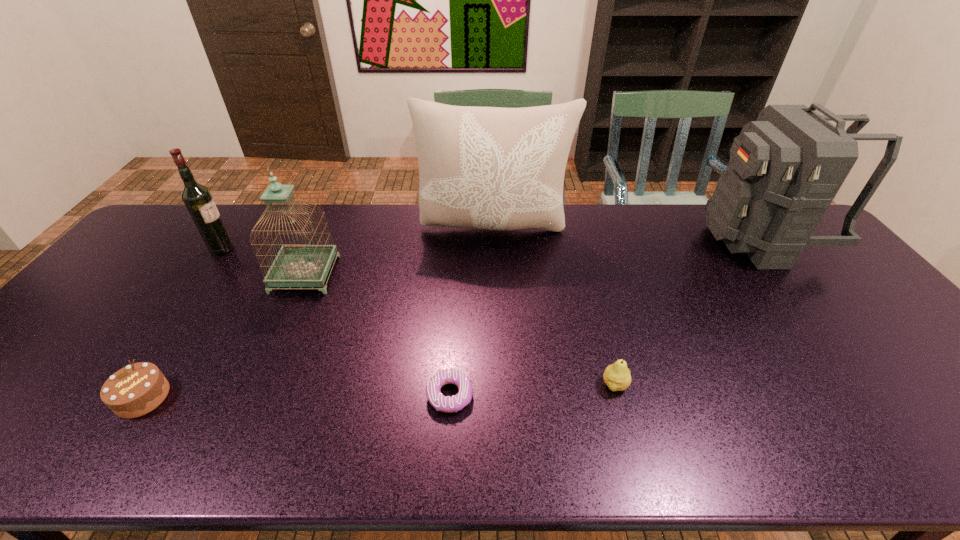
This screenshot has width=960, height=540. I want to click on free space that satisfies the following two spatial constraints: 1. on the front and back of the pear; 2. on the left side of the wine bottle, so click(128, 384).

Find the location of a particular element. The image size is (960, 540). blank area in the image that satisfies the following two spatial constraints: 1. on the front compartment of the rightmost object; 2. on the front side of the pear is located at coordinates (874, 384).

Identify the location of free space that satisfies the following two spatial constraints: 1. at the door of the pear; 2. on the right side of the third object from left to right. The width and height of the screenshot is (960, 540). (257, 384).

The image size is (960, 540). Find the location of `vacant space that satisfies the following two spatial constraints: 1. on the front and back of the wine bottle; 2. on the left side of the chocolate cake`. vacant space that satisfies the following two spatial constraints: 1. on the front and back of the wine bottle; 2. on the left side of the chocolate cake is located at coordinates (119, 397).

The width and height of the screenshot is (960, 540). Identify the location of free space that satisfies the following two spatial constraints: 1. on the front and back of the chocolate cake; 2. on the left side of the wine bottle. (119, 397).